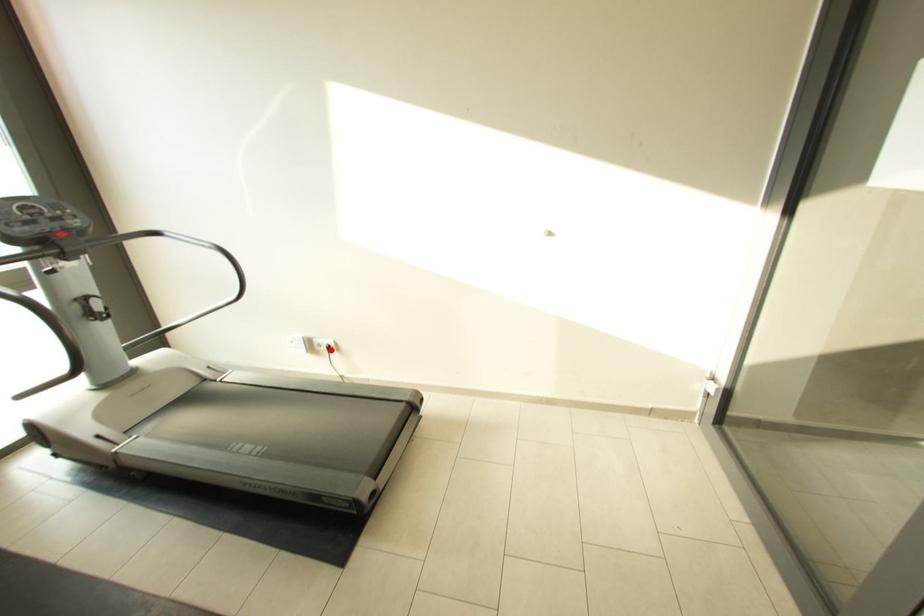
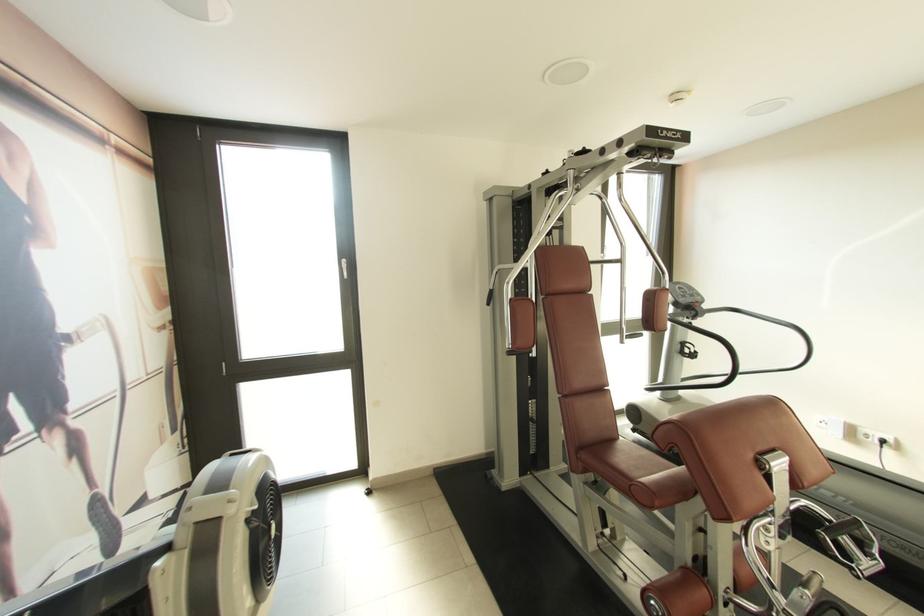
The point at the highlighted location is marked in the first image. Where is the corresponding point in the second image?

(882, 445)